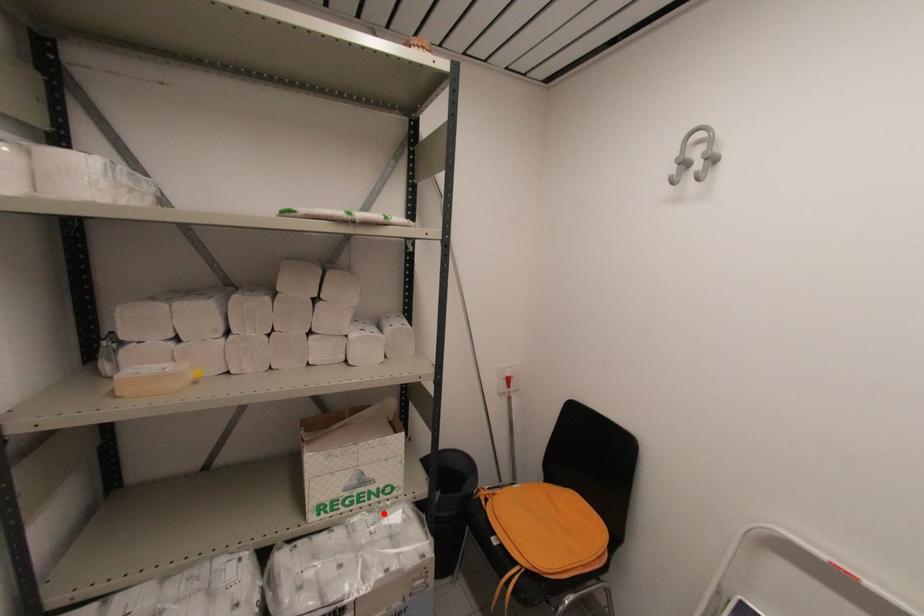
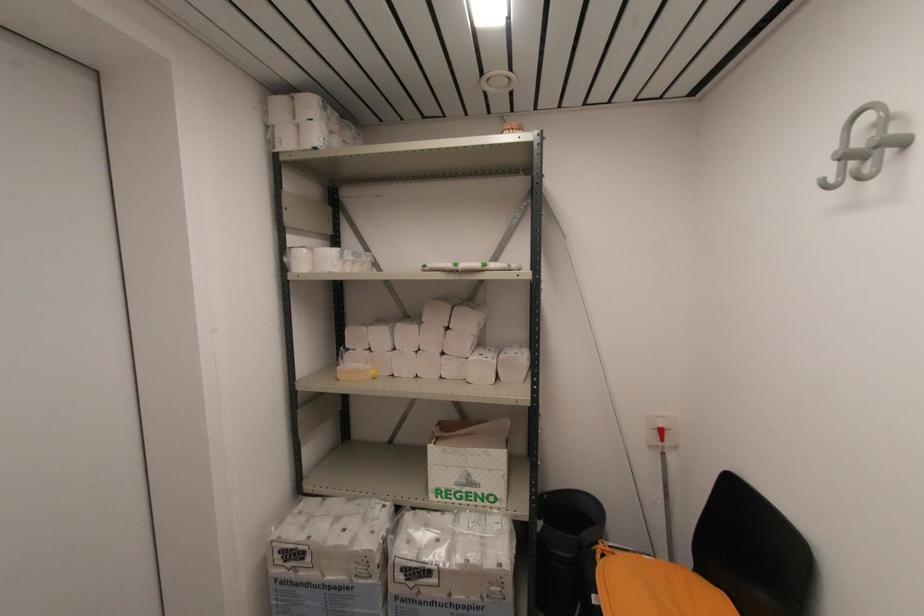
The point at the highlighted location is marked in the first image. Where is the corresponding point in the second image?

(484, 517)